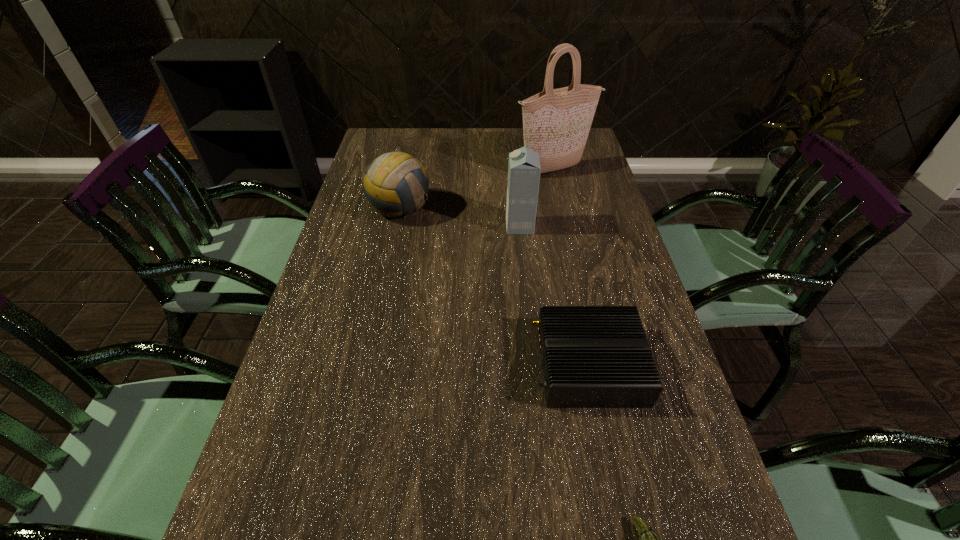
Find the location of a particular element. This screenshot has height=540, width=960. free space located 0.070m on the front label of the carton is located at coordinates (483, 226).

The image size is (960, 540). I want to click on blank space located on the right of the leftmost object, so click(x=543, y=208).

Find the location of `vacant space situated on the back panel of the fourth farthest object`. vacant space situated on the back panel of the fourth farthest object is located at coordinates (474, 364).

Find the location of a particular element. Image resolution: width=960 pixels, height=540 pixels. vacant space located on the back panel of the fourth farthest object is located at coordinates (392, 364).

This screenshot has width=960, height=540. Find the location of `vacant space located 0.380m on the back panel of the fourth farthest object`. vacant space located 0.380m on the back panel of the fourth farthest object is located at coordinates (360, 364).

Where is `object present at the far edge`? object present at the far edge is located at coordinates (556, 122).

Locate an element on the screen. object that is at the left edge is located at coordinates (396, 184).

Find the location of a particular element. This screenshot has width=960, height=540. shopping bag located at the right edge is located at coordinates (556, 122).

Identify the location of router that is at the right edge. The width and height of the screenshot is (960, 540). (592, 356).

Locate an element on the screen. object present at the far right corner is located at coordinates (556, 122).